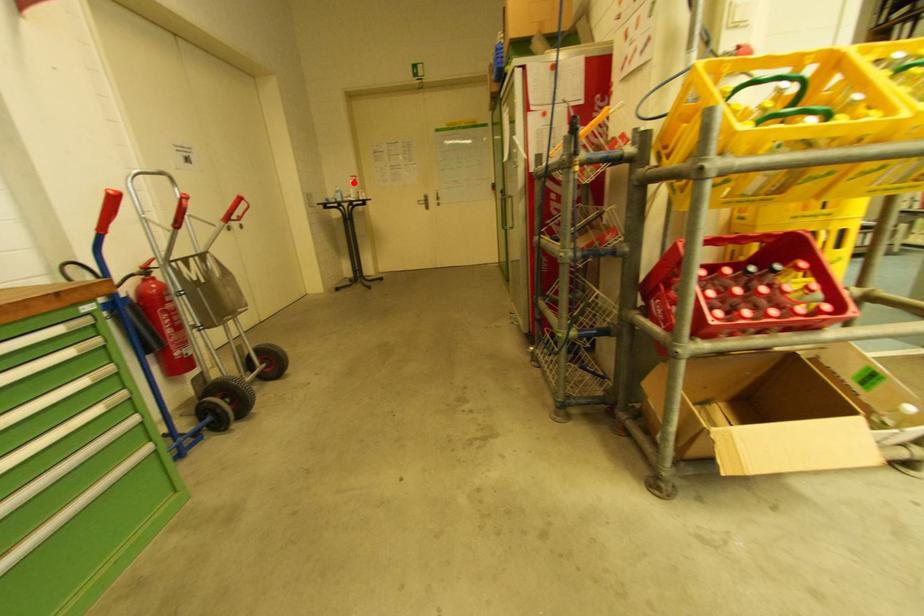
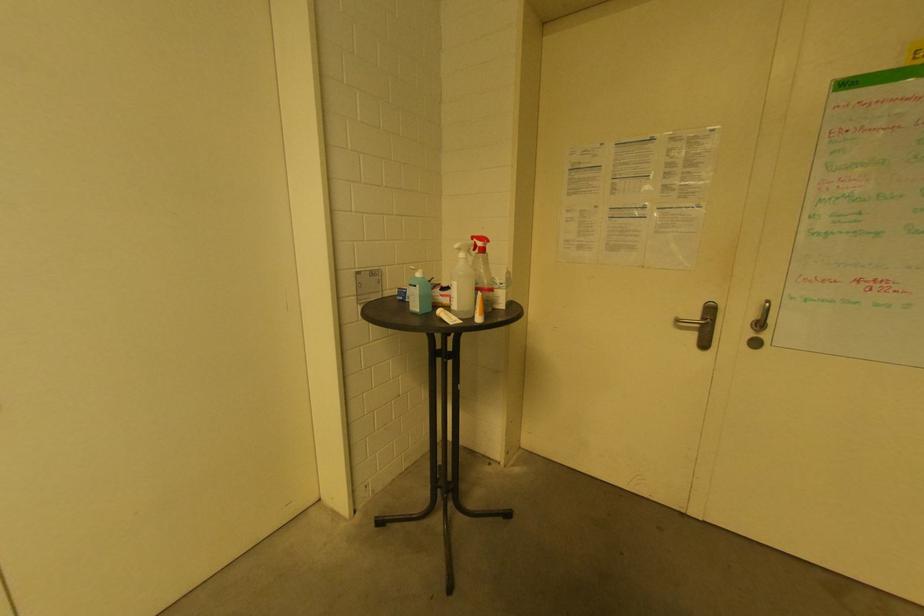
Locate, in the second image, the point that corresponds to the highlighted location in the first image.

(464, 256)